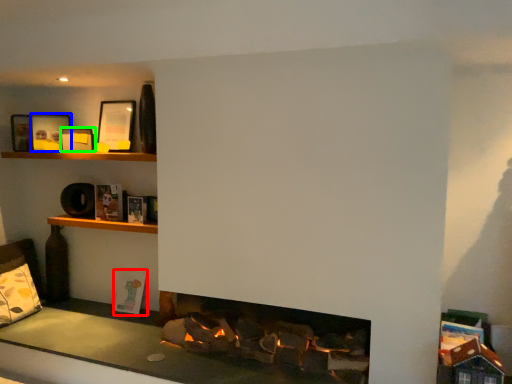
Question: Which object is the closest to the book (highlighted by a red box)? Choose among these: picture frame (highlighted by a blue box) or picture frame (highlighted by a green box).

Choices:
 (A) picture frame
 (B) picture frame

Answer: (B)